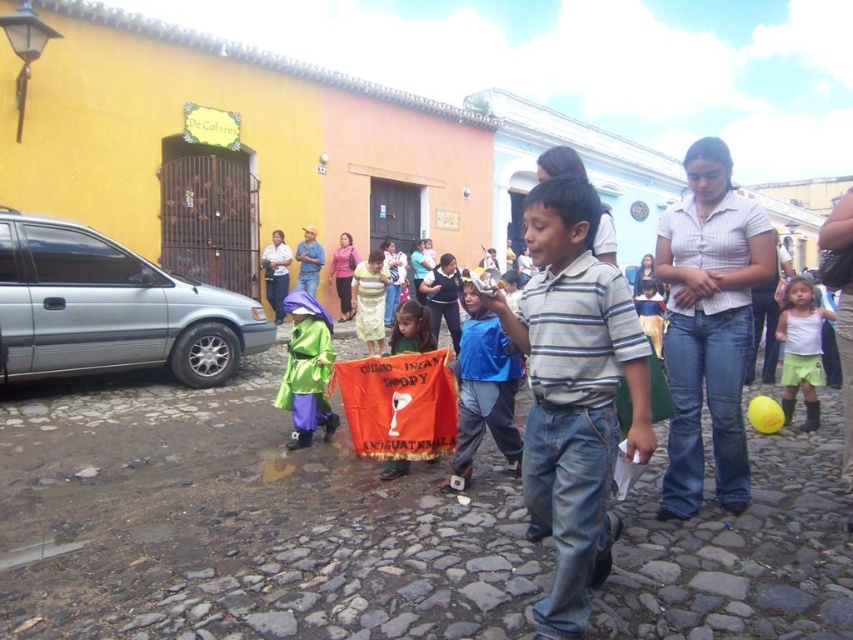
You are a shopkeeper organizing clothes in your store. You have two shirts at the center of your display window. The striped cotton shirt at center and the blue cotton shirt at center. Which shirt should you place on the top shelf if you want to arrange them by size from smallest to largest?

The striped cotton shirt at center is smaller than the blue cotton shirt at center, so you should place the striped cotton shirt at center on the top shelf and the blue cotton shirt at center below it.

Please provide the coordinates of the blue cotton shirt at center in the image. The coordinate system is defined with the origin at the bottom left corner of the image, with x and y axes increasing to the right and up respectively. The coordinates are normalized between 0 and 1.

The coordinates of the blue cotton shirt at center are at point 0.608 in the x axis and 0.569 in the y axis.

In the scene shown: You are standing at the point marked as point (573, 394) in the image. What is the nearest object to you?

The nearest object to you is the striped cotton shirt at center.